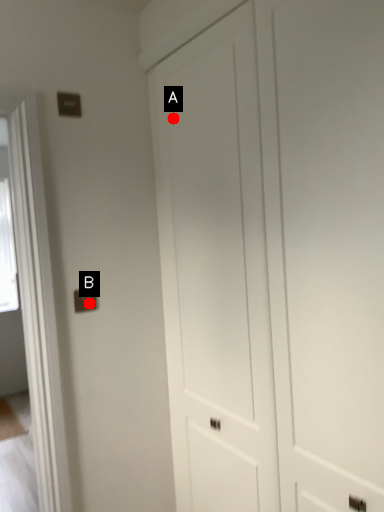
Question: Two points are circled on the image, labeled by A and B beside each circle. Among these points, which one is farthest from the camera?

Choices:
 (A) A is further
 (B) B is further

Answer: (B)